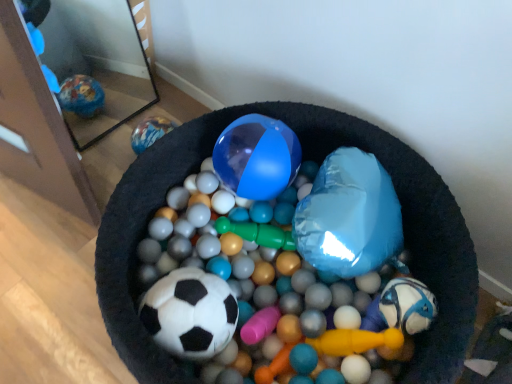
What is the approximate height of shiny blue ball at center?

shiny blue ball at center is 10.13 inches in height.

Describe the element at coordinates (280, 266) in the screenshot. I see `shiny blue ball at center` at that location.

The image size is (512, 384). Find the location of `shiny blue ball at center`. shiny blue ball at center is located at coordinates (280, 266).

At what (x,y) coordinates should I click in order to perform the action: click on shiny blue ball at center. Please return your answer as a coordinate pair (x, y). The width and height of the screenshot is (512, 384). Looking at the image, I should click on (280, 266).